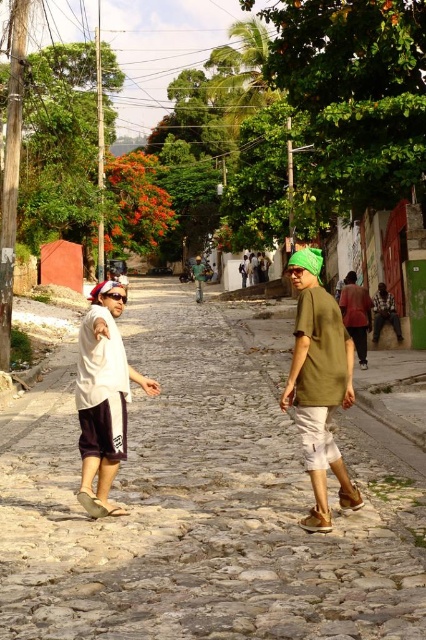
Question: Considering the real-world distances, which object is closest to the green matte shirt at center?

Choices:
 (A) matte olive-green shirt at center
 (B) white matte shirt at left
 (C) cobblestone street at center
 (D) matte green shirt at center

Answer: (D)

Question: Does cobblestone street at center have a larger size compared to green matte shirt at center?

Choices:
 (A) yes
 (B) no

Answer: (B)

Question: Which point is closer to the camera taking this photo?

Choices:
 (A) (370, 305)
 (B) (258, 269)
 (C) (198, 262)

Answer: (A)

Question: Can you confirm if matte green shirt at right is positioned below matte green shirt at center?

Choices:
 (A) yes
 (B) no

Answer: (A)

Question: Does matte olive-green shirt at center appear on the right side of white matte shirt at left?

Choices:
 (A) no
 (B) yes

Answer: (B)

Question: Which point is closer to the camera taking this photo?

Choices:
 (A) (115, 625)
 (B) (388, 300)
 (C) (83, 394)
 (D) (325, 440)

Answer: (A)